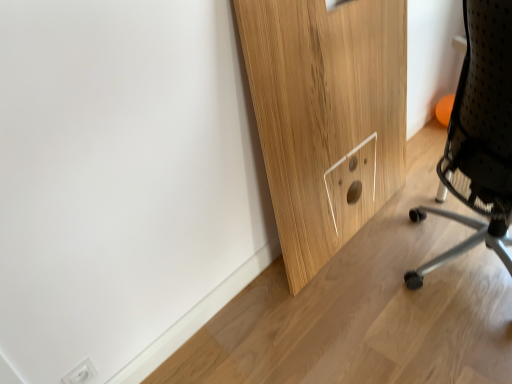
The image size is (512, 384). I want to click on vacant space situated on the left part of black mesh chair at right, so click(383, 254).